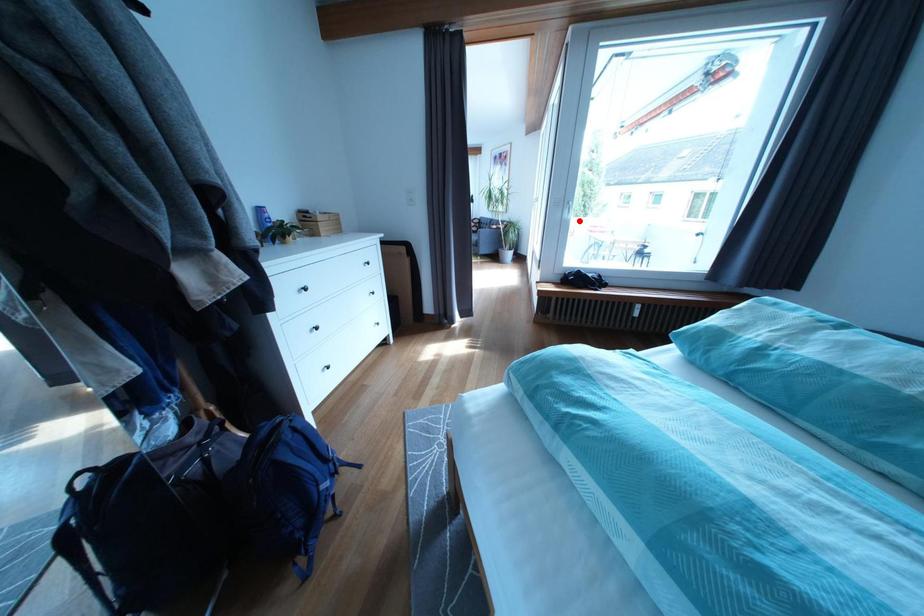
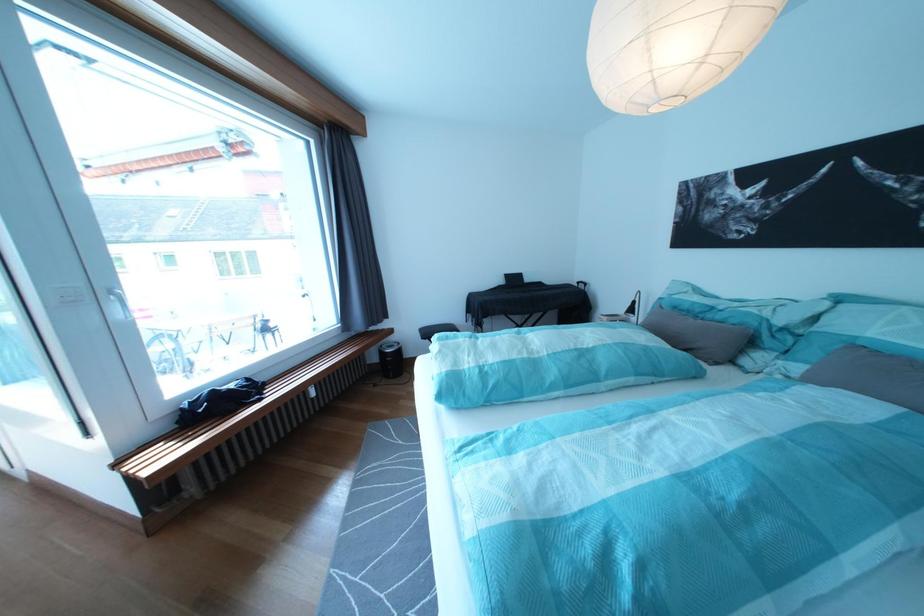
Where in the second image is the point corresponding to the highlighted location from the first image?

(130, 321)